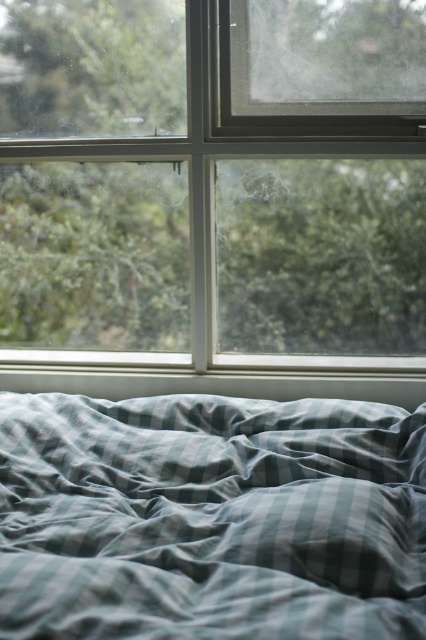
Is clear glass window at upper center closer to the viewer compared to green striped fabric at lower center?

No, clear glass window at upper center is behind green striped fabric at lower center.

Is point (31, 273) positioned behind point (409, 488)?

Yes, point (31, 273) is farther from viewer.

Find the location of a particular element. clear glass window at upper center is located at coordinates (213, 177).